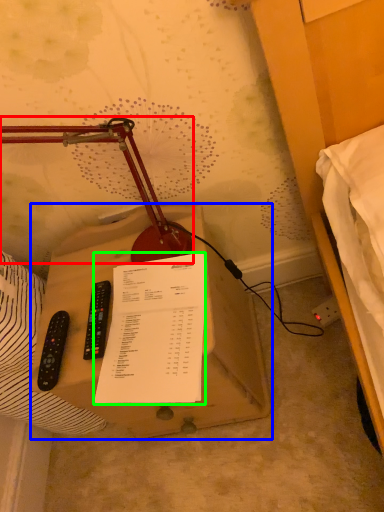
Question: Which object is positioned closest to lamp (highlighted by a red box)? Select from table (highlighted by a blue box) and document (highlighted by a green box).

Choices:
 (A) table
 (B) document

Answer: (B)